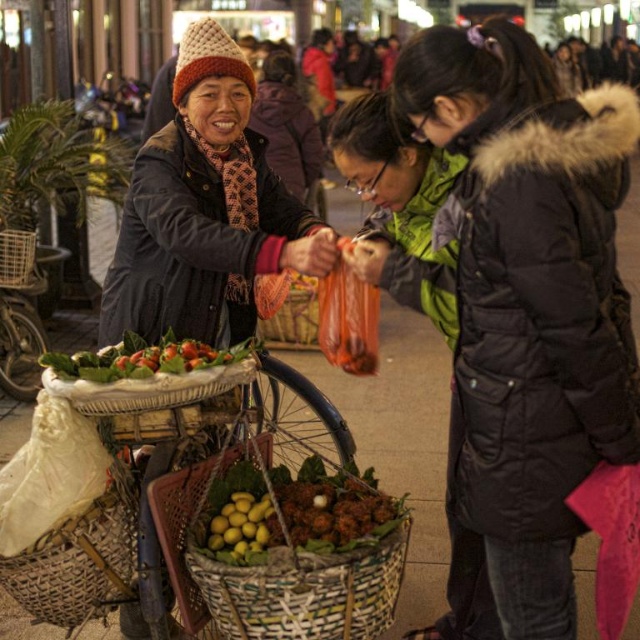
Is brown woven basket at center taller than woven brown basket at lower left?

No.

Who is positioned more to the left, brown woven basket at center or woven brown basket at lower left?

Positioned to the left is woven brown basket at lower left.

Describe the element at coordinates (305, 589) in the screenshot. This screenshot has height=640, width=640. I see `brown woven basket at center` at that location.

Identify the location of brown woven basket at center. This screenshot has width=640, height=640. click(305, 589).

Which is behind, point (122, 572) or point (148, 371)?

The point (122, 572) is more distant.

Does woven brown basket at lower left have a larger size compared to green leafy vegetables at center?

Yes.

Where is `woven brown basket at lower left`? woven brown basket at lower left is located at coordinates (80, 563).

Locate an element on the screen. This screenshot has width=640, height=640. woven brown basket at lower left is located at coordinates (80, 563).

Which is behind, point (232, 548) or point (237, 358)?

The point (237, 358) is more distant.

Which is in front, point (204, 518) or point (152, 356)?

Point (204, 518)

Where is `yellowish-green leafy vegetables at center`? The width and height of the screenshot is (640, 640). yellowish-green leafy vegetables at center is located at coordinates (296, 513).